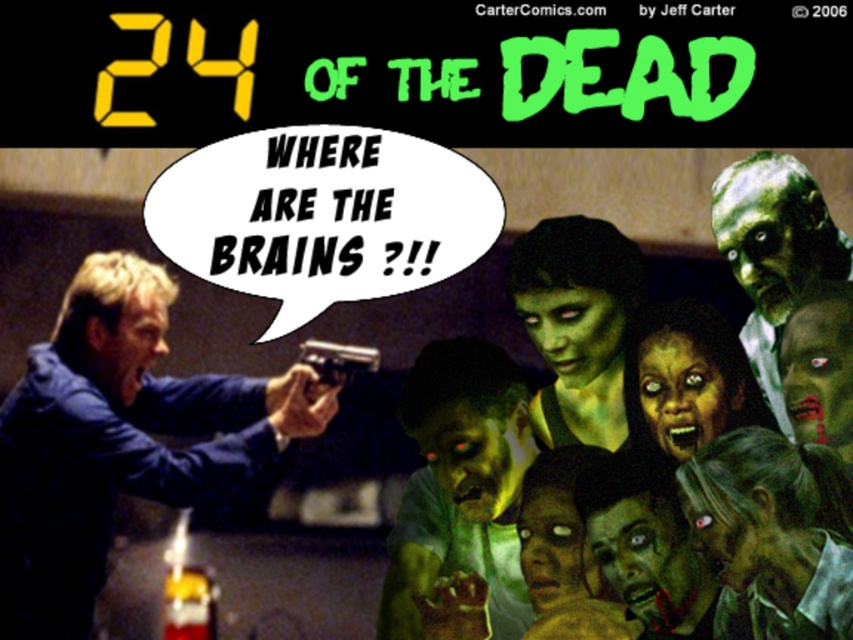
Based on the scene described, where is the blue fabric jacket at left in relation to the greenish skin zombie at center?

The blue fabric jacket at left is located below the greenish skin zombie at center.